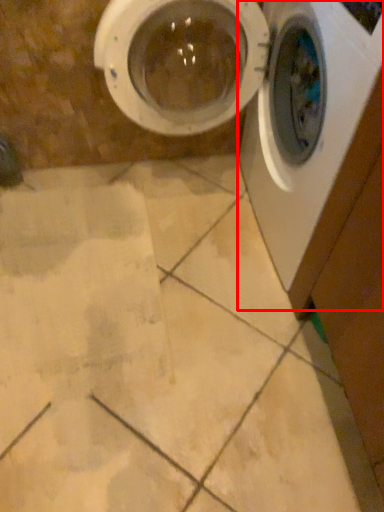
Question: From the image's perspective, what is the correct spatial positioning of washing machine (annotated by the red box) in reference to washing machine?

Choices:
 (A) below
 (B) above

Answer: (A)